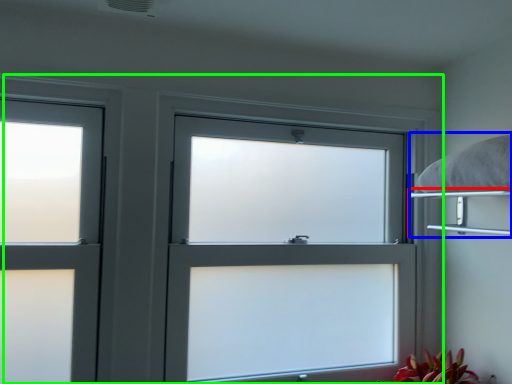
Question: Which object is the farthest from shelf (highlighted by a red box)? Choose among these: bed (highlighted by a blue box) or window (highlighted by a green box).

Choices:
 (A) bed
 (B) window

Answer: (B)